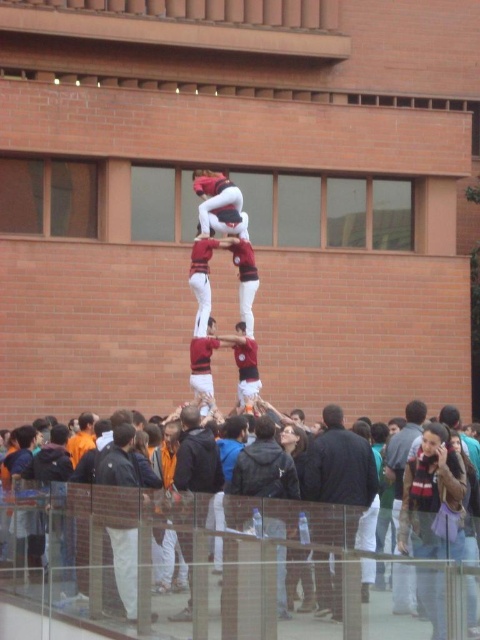
You are standing in front of the brick building and see the human tower. There is a point at coordinates (337, 481) in the image. What object is located at that point?

The point at coordinates (337, 481) is on the dark blue jacket at center.

You are a photographer standing at the front of the crowd. You want to take a photo of the dark blue jacket at center. Where should you aim your camera to capture it?

The dark blue jacket at center is located at the coordinates point (337,481), so you should aim your camera at that specific point to capture it.

You are a photographer standing at the back of the scene. You want to take a photo of the dark gray hoodie at center without the dark clothing crowd at lower center blocking the view. Is this possible?

The dark clothing crowd at lower center is positioned under the dark gray hoodie at center, so taking a photo from the back might still allow you to see the dark gray hoodie at center above the crowd.